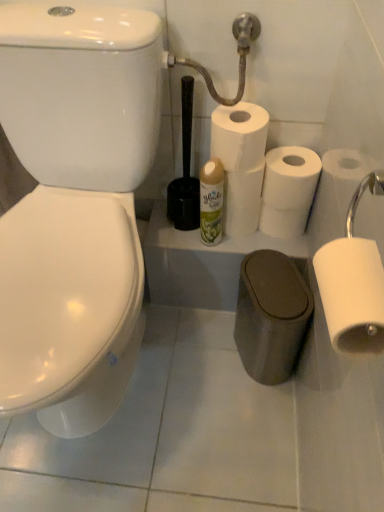
Where is `vacant space that is to the left of white glossy air freshener at center`? vacant space that is to the left of white glossy air freshener at center is located at coordinates (173, 234).